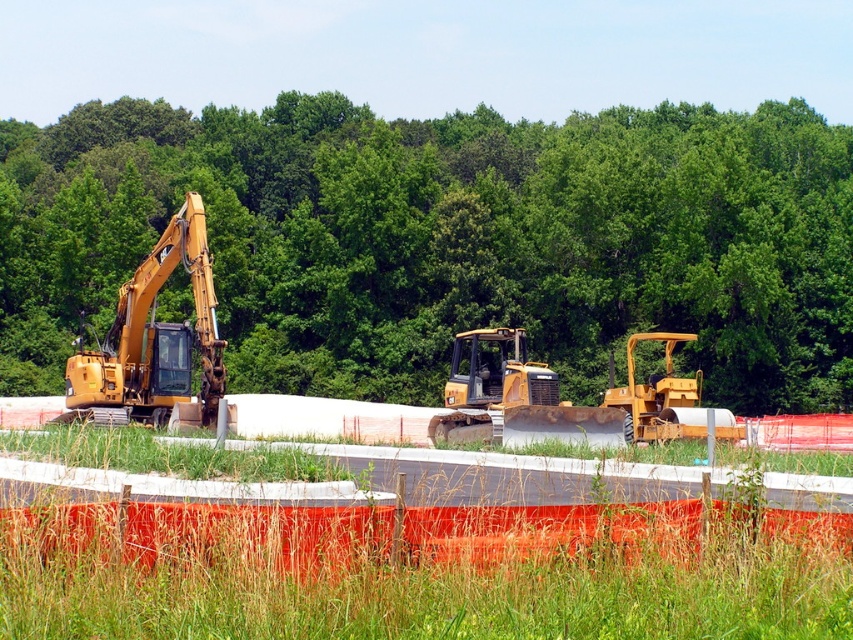
Looking at this image, you are a construction supervisor who needs to ensure that the green leafy trees at upper center and the yellow metallic excavator at left are visible in a photo for a safety report. Which object should you focus on more to capture its size accurately?

The green leafy trees at upper center are larger in size compared to the yellow metallic excavator at left, so you should focus more on capturing the green leafy trees at upper center to accurately represent their size in the photo.

You are a construction worker who needs to move a heavy crate from the yellow metallic excavator at left to the yellow rubber tractor at right. Which direction should you move the crate to get it closer to the tractor?

The yellow rubber tractor at right is behind the yellow metallic excavator at left, so you should move the crate backward to get closer to the tractor.

You are a crane operator observing a construction site. You notice two pieces of equipment, the yellow metallic excavator at left and the yellow rubber tractor at right. Which one has a higher height?

The yellow metallic excavator at left is taller than the yellow rubber tractor at right.